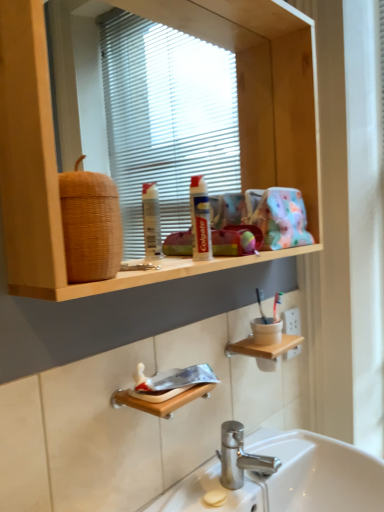
Find the location of `white glossy sink at lower center`. white glossy sink at lower center is located at coordinates (288, 478).

From a real-world perspective, who is located lower, woven brown basket at upper left or wooden shelf at lower center?

In real-world perspective, wooden shelf at lower center is lower.

Identify the location of shelf directly beneath the woven brown basket at upper left (from a real-world perspective). Image resolution: width=384 pixels, height=512 pixels. (263, 347).

Considering the sizes of objects woven brown basket at upper left and wooden shelf at lower center in the image provided, who is thinner, woven brown basket at upper left or wooden shelf at lower center?

Thinner between the two is woven brown basket at upper left.

Would you say woven brown basket at upper left is to the left or to the right of wooden shelf at lower center in the picture?

Clearly, woven brown basket at upper left is on the left of wooden shelf at lower center in the image.

From the picture: Which of these two, wooden shelf at upper center or woven brown basket at upper left, is wider?

Wider between the two is wooden shelf at upper center.

From a real-world perspective, relative to woven brown basket at upper left, is wooden shelf at upper center vertically above or below?

Clearly, from a real-world perspective, wooden shelf at upper center is above woven brown basket at upper left.

Is wooden shelf at upper center turned away from woven brown basket at upper left?

That's right, wooden shelf at upper center is facing away from woven brown basket at upper left.

Considering the relative sizes of white glossy sink at lower center and wooden shelf at lower center in the image provided, is white glossy sink at lower center shorter than wooden shelf at lower center?

No.

Is white glossy sink at lower center completely or partially outside of wooden shelf at lower center?

Indeed, white glossy sink at lower center is completely outside wooden shelf at lower center.

Is white glossy sink at lower center facing towards wooden shelf at lower center?

No.

Which of these two, white glossy sink at lower center or wooden shelf at lower center, is thinner?

wooden shelf at lower center is thinner.

Looking at this image, is woven brown basket at upper left aimed at wooden shelf at upper center?

Yes, woven brown basket at upper left is aimed at wooden shelf at upper center.

Considering the positions of points (67, 196) and (26, 292), is point (67, 196) farther from camera compared to point (26, 292)?

No.

From the image's perspective, which is above, woven brown basket at upper left or wooden shelf at upper center?

From the image's view, wooden shelf at upper center is above.

Considering the relative sizes of woven brown basket at upper left and wooden shelf at upper center in the image provided, is woven brown basket at upper left shorter than wooden shelf at upper center?

Yes.

From the image's perspective, who appears lower, wooden shelf at lower center or white glossy sink at lower center?

white glossy sink at lower center appears lower in the image.

Does wooden shelf at lower center have a smaller size compared to white glossy sink at lower center?

Yes, wooden shelf at lower center is smaller than white glossy sink at lower center.

From a real-world perspective, is wooden shelf at lower center positioned above or below white glossy sink at lower center?

Clearly, from a real-world perspective, wooden shelf at lower center is above white glossy sink at lower center.

Is wooden shelf at lower center outside of white glossy sink at lower center?

Yes, wooden shelf at lower center is located beyond the bounds of white glossy sink at lower center.

Is white glossy sink at lower center in front of or behind woven brown basket at upper left in the image?

In the image, white glossy sink at lower center appears behind woven brown basket at upper left.

Is white glossy sink at lower center beside woven brown basket at upper left?

white glossy sink at lower center and woven brown basket at upper left are clearly separated.

Is white glossy sink at lower center oriented towards woven brown basket at upper left?

No, white glossy sink at lower center is not facing towards woven brown basket at upper left.

From the image's perspective, which object appears higher, woven brown basket at upper left or white glossy sink at lower center?

From the image's view, woven brown basket at upper left is above.

Is woven brown basket at upper left far from white glossy sink at lower center?

No.

From the picture: Based on their positions, is woven brown basket at upper left located to the left or right of white glossy sink at lower center?

Based on their positions, woven brown basket at upper left is located to the left of white glossy sink at lower center.

Considering the positions of objects woven brown basket at upper left and white glossy sink at lower center in the image provided, who is behind, woven brown basket at upper left or white glossy sink at lower center?

Positioned behind is white glossy sink at lower center.

Find the location of `basket above the wooden shelf at lower center (from a real-world perspective)`. basket above the wooden shelf at lower center (from a real-world perspective) is located at coordinates (90, 225).

The image size is (384, 512). Find the location of `basket on the left side of wooden shelf at upper center`. basket on the left side of wooden shelf at upper center is located at coordinates (90, 225).

Based on their spatial positions, is wooden shelf at upper center or white glossy sink at lower center further from woven brown basket at upper left?

Among the two, white glossy sink at lower center is located further to woven brown basket at upper left.

From the image, which object appears to be farther from woven brown basket at upper left, wooden shelf at upper center or wooden shelf at lower center?

Among the two, wooden shelf at lower center is located further to woven brown basket at upper left.

Based on their spatial positions, is wooden shelf at upper center or wooden shelf at lower center closer to white glossy sink at lower center?

wooden shelf at lower center is positioned closer to the anchor white glossy sink at lower center.

Estimate the real-world distances between objects in this image. Which object is closer to wooden shelf at upper center, wooden shelf at lower center or white glossy sink at lower center?

Among the two, wooden shelf at lower center is located nearer to wooden shelf at upper center.

Estimate the real-world distances between objects in this image. Which object is further from wooden shelf at lower center, white glossy sink at lower center or wooden shelf at upper center?

Among the two, wooden shelf at upper center is located further to wooden shelf at lower center.

Based on their spatial positions, is woven brown basket at upper left or wooden shelf at lower center further from white glossy sink at lower center?

woven brown basket at upper left.

Looking at the image, which one is located closer to wooden shelf at upper center, white glossy sink at lower center or woven brown basket at upper left?

Among the two, woven brown basket at upper left is located nearer to wooden shelf at upper center.

Which object lies nearer to the anchor point wooden shelf at upper center, white glossy sink at lower center or wooden shelf at lower center?

wooden shelf at lower center is positioned closer to the anchor wooden shelf at upper center.

The image size is (384, 512). Identify the location of basket between wooden shelf at upper center and white glossy sink at lower center vertically. (90, 225).

What are the coordinates of `shelf between woven brown basket at upper left and white glossy sink at lower center vertically` in the screenshot? It's located at (263, 347).

This screenshot has height=512, width=384. Identify the location of basket between wooden shelf at upper center and wooden shelf at lower center from top to bottom. (90, 225).

I want to click on shelf between wooden shelf at upper center and white glossy sink at lower center in the vertical direction, so click(263, 347).